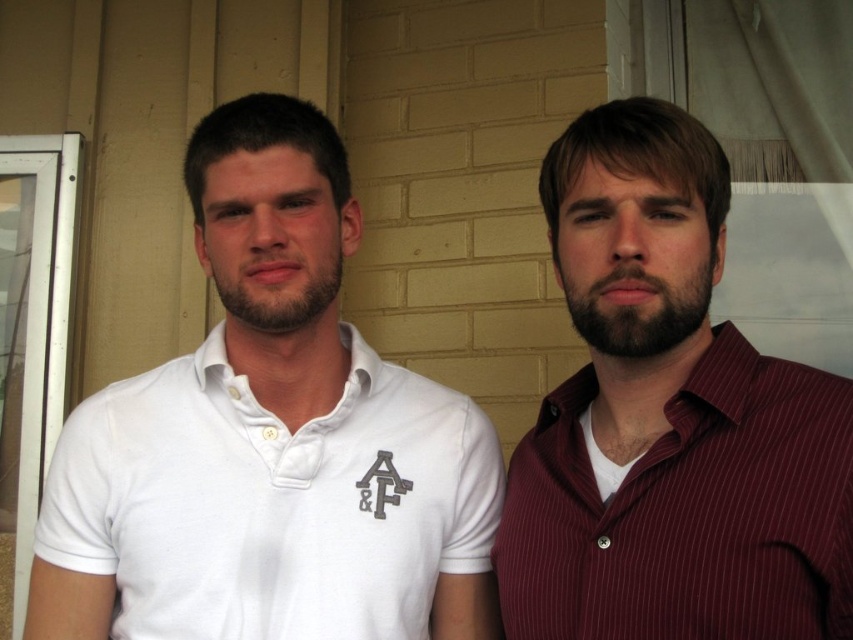
Question: Does white cotton polo shirt at left appear under maroon striped shirt at right?

Choices:
 (A) yes
 (B) no

Answer: (A)

Question: Does white cotton polo shirt at left have a greater width compared to maroon striped shirt at right?

Choices:
 (A) no
 (B) yes

Answer: (B)

Question: Which object appears closest to the camera in this image?

Choices:
 (A) white cotton polo shirt at left
 (B) maroon striped shirt at right

Answer: (B)

Question: Which point is farther to the camera?

Choices:
 (A) (254, 216)
 (B) (587, 227)

Answer: (A)

Question: Can you confirm if white cotton polo shirt at left is bigger than maroon striped shirt at right?

Choices:
 (A) no
 (B) yes

Answer: (B)